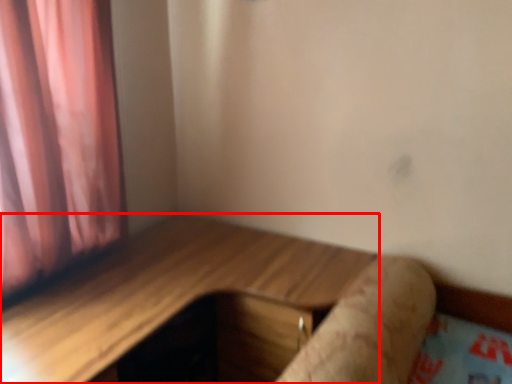
Question: Considering the relative positions of table (annotated by the red box) and log in the image provided, where is table (annotated by the red box) located with respect to the staircase?

Choices:
 (A) left
 (B) right

Answer: (A)